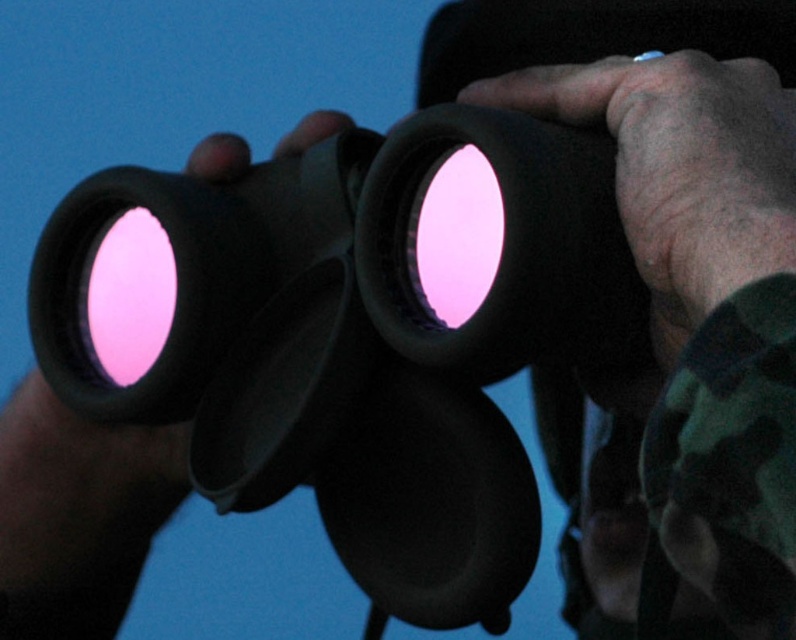
Who is positioned more to the left, camo fabric at center or matte black binoculars at center?

Positioned to the left is matte black binoculars at center.

Is point (763, 392) in front of point (45, 408)?

That is True.

Between point (701, 440) and point (162, 500), which one is positioned behind?

Point (162, 500)

This screenshot has height=640, width=796. In order to click on camo fabric at center in this screenshot , I will do `click(726, 467)`.